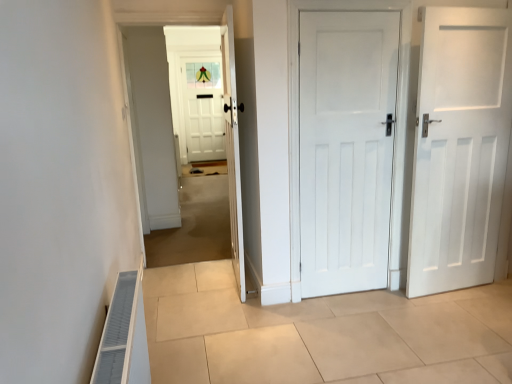
Identify the location of unoccupied region to the right of white painted wood door at center, positioned as the second door in left-to-right order. This screenshot has width=512, height=384. (404, 304).